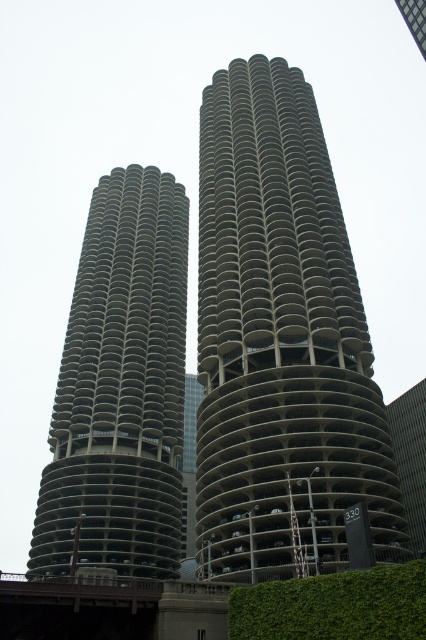
You are standing on the bridge in front of the two iconic Chicago buildings. You want to take a photo that includes both the gray concrete building at center and the green leafy hedge at lower right. Which direction should you move to ensure both are in your camera frame?

You should move to the right so that both the gray concrete building at center and the green leafy hedge at lower right are visible in your frame since the gray concrete building at center is to the left of the green leafy hedge at lower right.

You are a tourist standing on the bridge near the gray concrete building at left and the green leafy hedge at lower right. Which object is closer to you as you look towards the waterfront?

The gray concrete building at left is closer to you than the green leafy hedge at lower right because it is positioned further to the viewer in the scene.